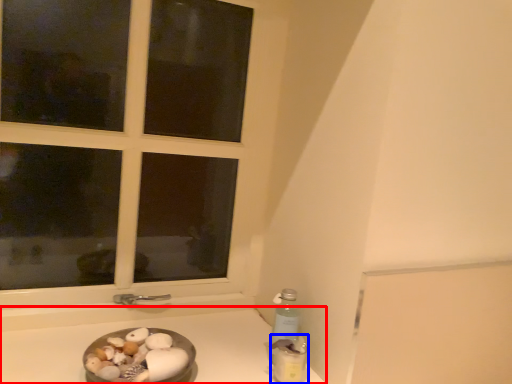
Question: Which point is further to the camera, counter top (highlighted by a red box) or bottle (highlighted by a blue box)?

Choices:
 (A) counter top
 (B) bottle

Answer: (B)